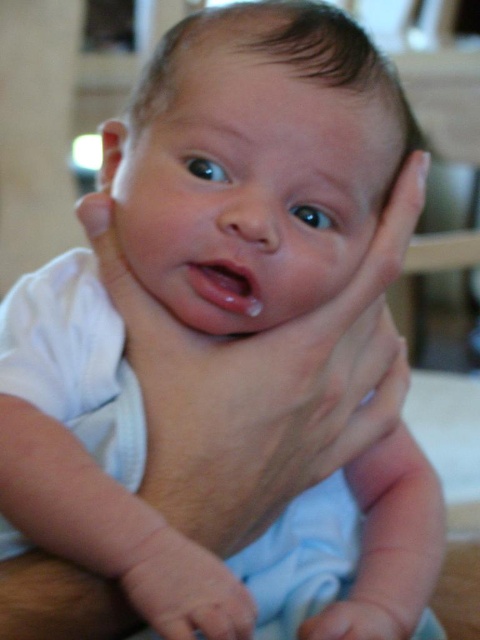
You are a photographer trying to capture the baby in focus. Since the two hands are smooth skin hand at center and smooth skin hand at lower center, which hand should you focus on to ensure the baby is sharp?

The smooth skin hand at center is in front of the smooth skin hand at lower center, so focusing on the smooth skin hand at center will ensure the baby is sharp.

You are a photographer setting up a close shot of a baby being held by two hands. You need to ensure the composition highlights both hands. Given the smooth skin hand at center and the smooth skin hand at lower center, which hand should you focus on to emphasize the larger one?

The smooth skin hand at center is larger in size than the smooth skin hand at lower center, so you should focus on the smooth skin hand at center to emphasize the larger one.

You are a photographer adjusting your camera to focus on two points in the image. The first point is point (173, 600) and the second is point (319, 632). Which point should you focus on first to ensure the baby is in focus?

Point (173, 600) is in front of point (319, 632), so you should focus on point (173, 600) first to ensure the baby is in focus.